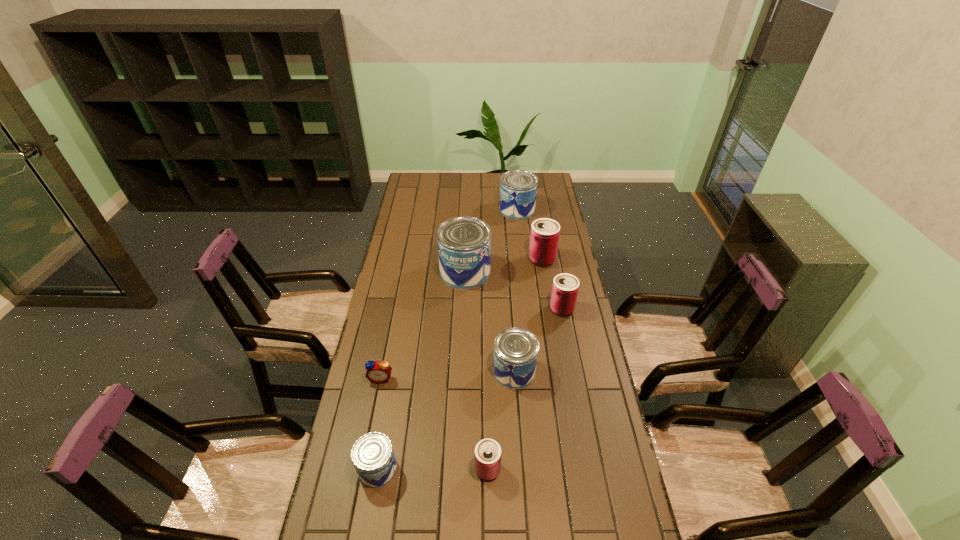
The image size is (960, 540). I want to click on free space located on the front label of the third farthest blue can, so click(x=410, y=371).

I want to click on free space located 0.170m on the front label of the third farthest blue can, so click(443, 371).

Identify the location of free point located on the front label of the third farthest blue can. The image size is (960, 540). (417, 371).

Identify the location of vacant area situated on the front-facing side of the alarm clock. This screenshot has height=540, width=960. (354, 513).

The width and height of the screenshot is (960, 540). What are the coordinates of `vacant space located on the back of the leftmost pink can` in the screenshot? It's located at click(487, 431).

Find the location of a particular element. The image size is (960, 540). alarm clock that is at the left edge is located at coordinates (379, 372).

Locate an element on the screen. Image resolution: width=960 pixels, height=540 pixels. can located in the left edge section of the desktop is located at coordinates (372, 454).

In the image, there is a desktop. What are the coordinates of `free region at the far edge` in the screenshot? It's located at (443, 187).

This screenshot has height=540, width=960. I want to click on free region at the left edge of the desktop, so click(x=415, y=282).

In the image, there is a desktop. Find the location of `vacant space at the right edge`. vacant space at the right edge is located at coordinates (588, 321).